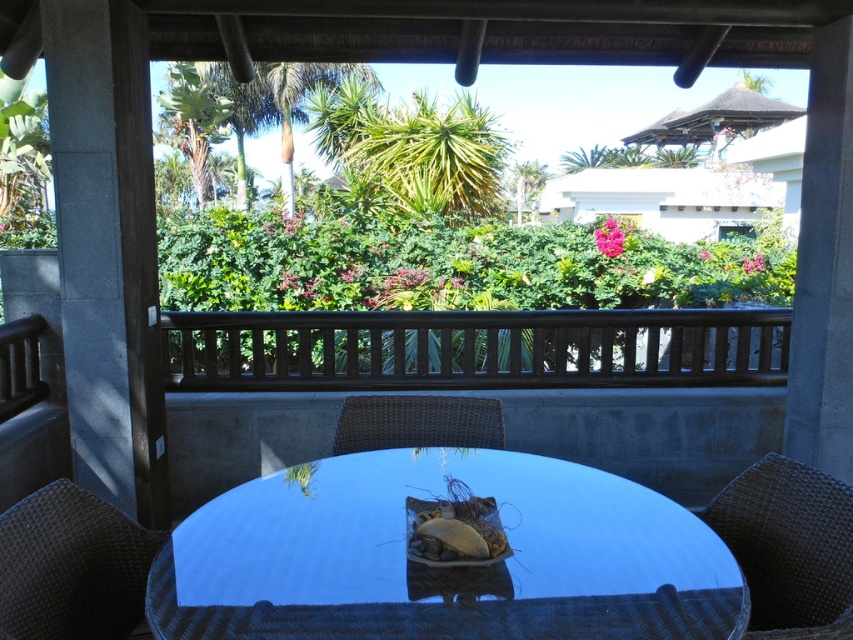
You are planning to place a small bench between the green leafy palm tree at center and the green leafy palm tree at upper left. Based on their widths, which palm tree would allow more space for the bench to be placed next to it?

The green leafy palm tree at upper left is narrower than the green leafy palm tree at center, so placing the bench next to the green leafy palm tree at upper left would provide more space.

You are standing on the patio and want to place a potted plant between the smooth glass table at center and the woven brown chair at center. Which object should the potted plant be closer to if you want it to be nearer to you?

The potted plant should be placed closer to the smooth glass table at center since it is already closer to you than the woven brown chair at center.

You are standing at the edge of the patio looking towards the table. There is a point marked at coordinates (440, 566). What object is located at this point?

The point at coordinates (440, 566) marks the location of the smooth glass table at center.